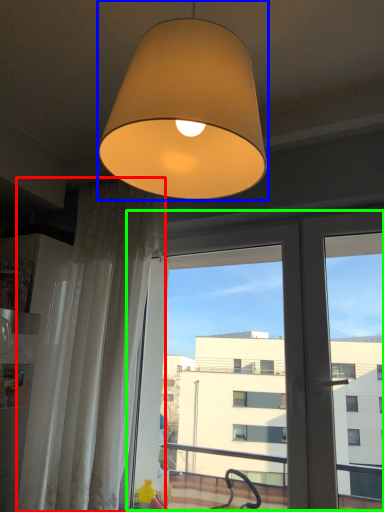
Question: Based on their relative distances, which object is farther from curtain (highlighted by a red box)? Choose from lamp (highlighted by a blue box) and screen door (highlighted by a green box).

Choices:
 (A) lamp
 (B) screen door

Answer: (A)